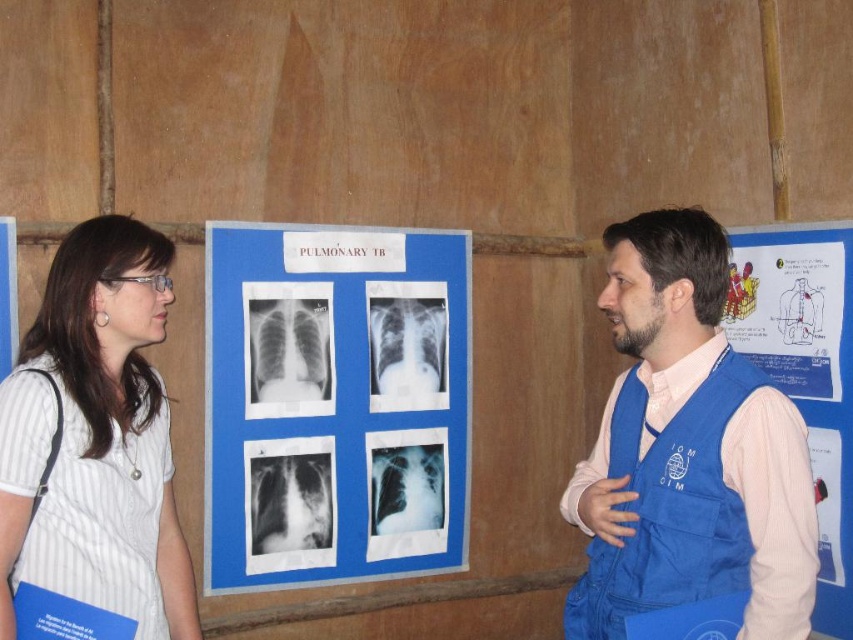
You are attending a medical seminar and see the white paper at center and the white striped shirt at left. Which object is located to the right of the other?

The white paper at center is positioned on the right side of the white striped shirt at left.

You are a photographer trying to capture a clear shot of the blue fabric poster at center without the blue fabric vest at center blocking it. Can you adjust your position to do so?

The blue fabric vest at center is above the blue fabric poster at center, so lowering your camera angle might allow you to capture the blue fabric poster at center without obstruction from the vest.

You are standing 6 feet away from the blue fabric vest at center. Can you reach it without moving your feet?

→ The blue fabric vest at center is 5.09 feet away from the viewer. Since you are standing 6 feet away, it is slightly out of reach without moving closer.